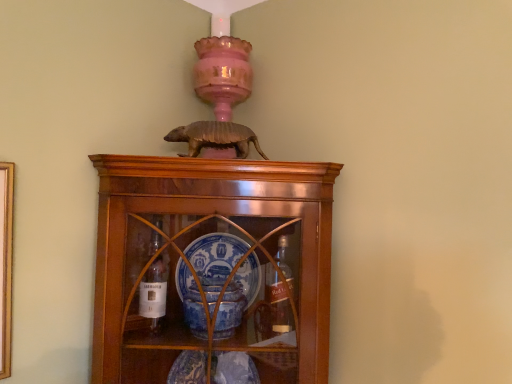
What is the approximate height of gold metallic armadillo at center?

3.58 inches.

The width and height of the screenshot is (512, 384). What do you see at coordinates (215, 137) in the screenshot? I see `gold metallic armadillo at center` at bounding box center [215, 137].

In order to face gold metallic armadillo at center, should I rotate leftwards or rightwards?

Turn left by 5.578 degrees to look at gold metallic armadillo at center.

Where is `gold metallic armadillo at center`? This screenshot has width=512, height=384. gold metallic armadillo at center is located at coordinates (215, 137).

Measure the distance between gold metallic armadillo at center and camera.

gold metallic armadillo at center is 1.07 meters away from camera.

The height and width of the screenshot is (384, 512). Identify the location of gold metallic armadillo at center. (215, 137).